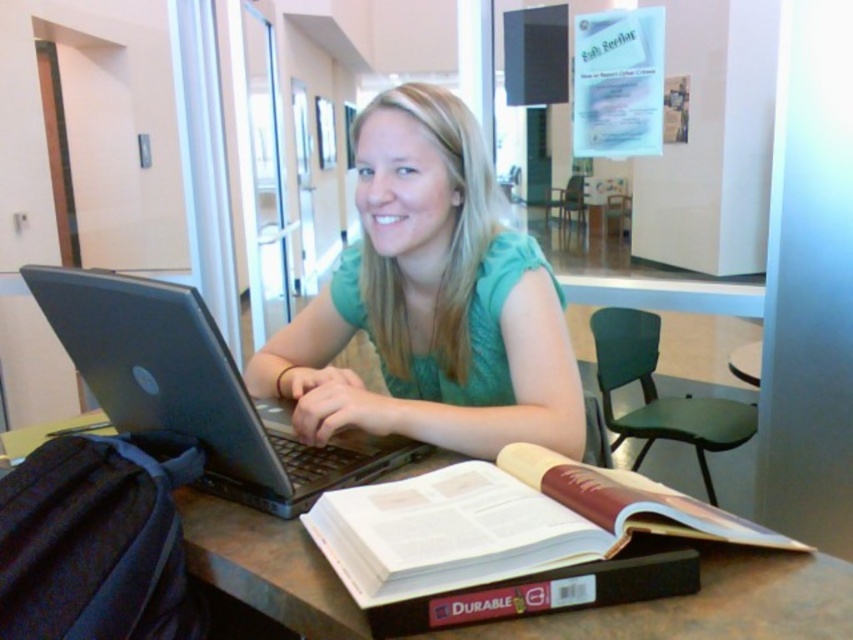
You are a student who needs to place a 10 cm wide notebook on the table. Can you fit it between the hardcover book at center and the brown wooden table at center?

The hardcover book at center and brown wooden table at center are 8.48 centimeters apart. Since the notebook is 10 cm wide, it won not fit between them.

You are a student who needs to place a 10 cm tall dictionary on the table. The dictionary must be placed on the hardcover book at center. Can you do this without the dictionary touching the brown wooden table at center?

The hardcover book at center has a lesser height compared to brown wooden table at center, so placing the 10 cm tall dictionary on the hardcover book at center would still keep it above the table. The dictionary will not touch the brown wooden table at center as long as it stays on the book.